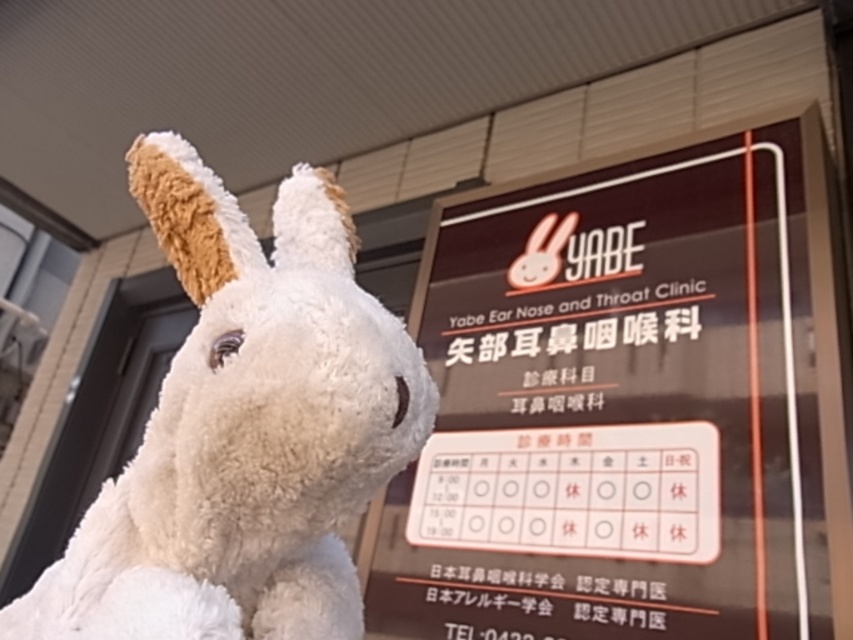
You are a patient entering the Yabe Ear Nose and Throat Clinic and see the matte black signboard at upper center and the white plush toy at left. Which object is positioned lower in the image?

The matte black signboard at upper center is located below the white plush toy at left, so the matte black signboard at upper center is positioned lower in the image.

You are a patient entering the Yabe Ear Nose and Throat Clinic and see the matte black signboard at upper center and the white plush toy at left. Which object is closer to you?

The white plush toy at left is closer to you because it is positioned behind the matte black signboard at upper center, meaning the signboard is in front of it.